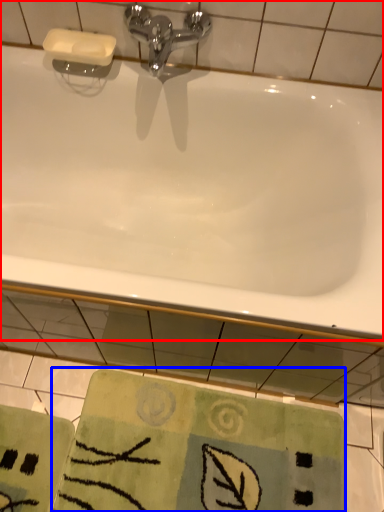
Question: Which point is further to the camera, bathtub (highlighted by a red box) or beach towel (highlighted by a blue box)?

Choices:
 (A) bathtub
 (B) beach towel

Answer: (B)